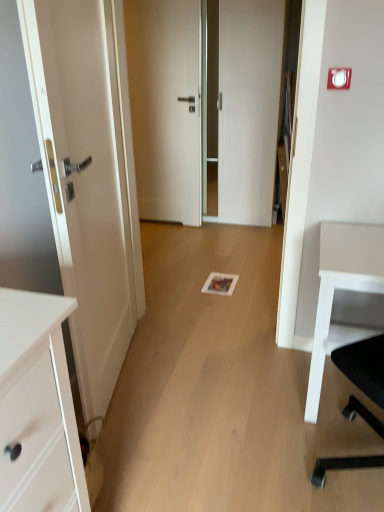
Find the location of a particular element. vacant area situated below white glossy door at left, the 3th door from the back (from a real-world perspective) is located at coordinates (129, 367).